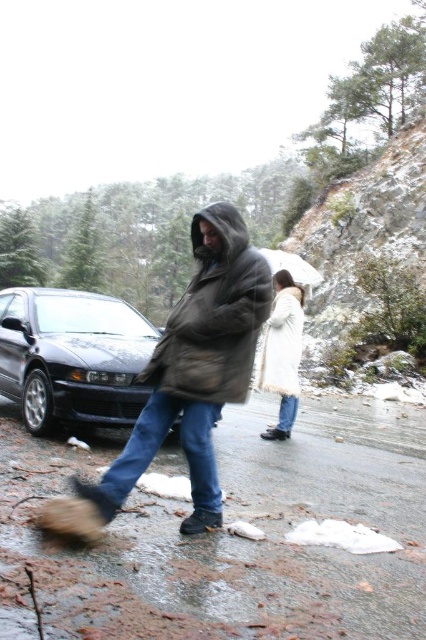
Between brown fuzzy coat at center and shiny black car at center, which one is positioned higher?

shiny black car at center is higher up.

Is brown fuzzy coat at center below shiny black car at center?

Correct, brown fuzzy coat at center is located below shiny black car at center.

Identify the location of brown fuzzy coat at center. This screenshot has height=640, width=426. (192, 371).

Is brown fuzzy coat at center further to camera compared to white fur coat at center?

No, it is not.

I want to click on brown fuzzy coat at center, so click(192, 371).

Who is more forward, (106, 420) or (288, 278)?

Answer: Point (106, 420) is in front.

Between point (71, 371) and point (264, 388), which one is positioned behind?

Point (264, 388)

Locate an element on the screen. The width and height of the screenshot is (426, 640). shiny black car at center is located at coordinates 72,356.